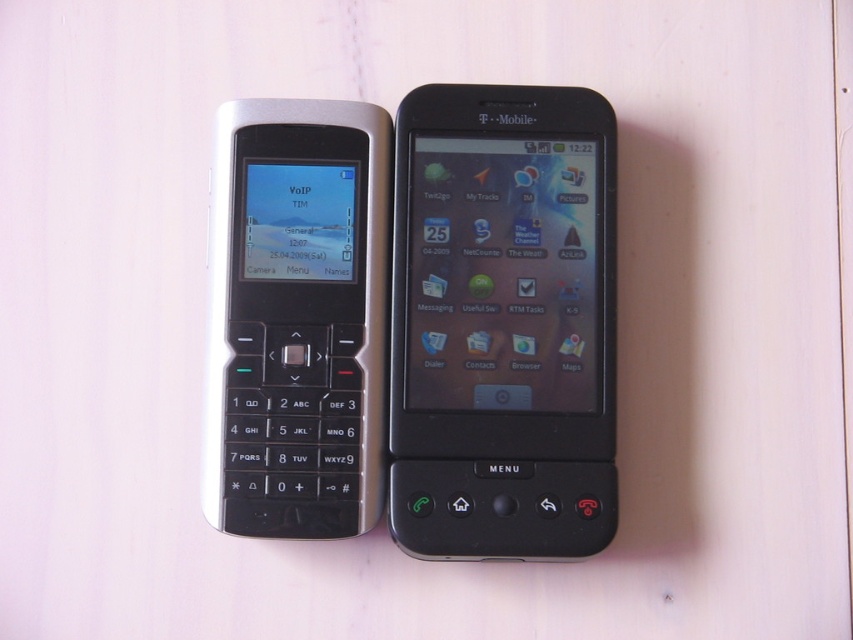
Between black plastic smartphone at center and silver metallic keypad phone at left, which one appears on the right side from the viewer's perspective?

black plastic smartphone at center

Who is more forward, (x=480, y=189) or (x=268, y=186)?

Point (x=268, y=186) is more forward.

This screenshot has height=640, width=853. What do you see at coordinates (503, 323) in the screenshot?
I see `black plastic smartphone at center` at bounding box center [503, 323].

Identify the location of black plastic smartphone at center. (503, 323).